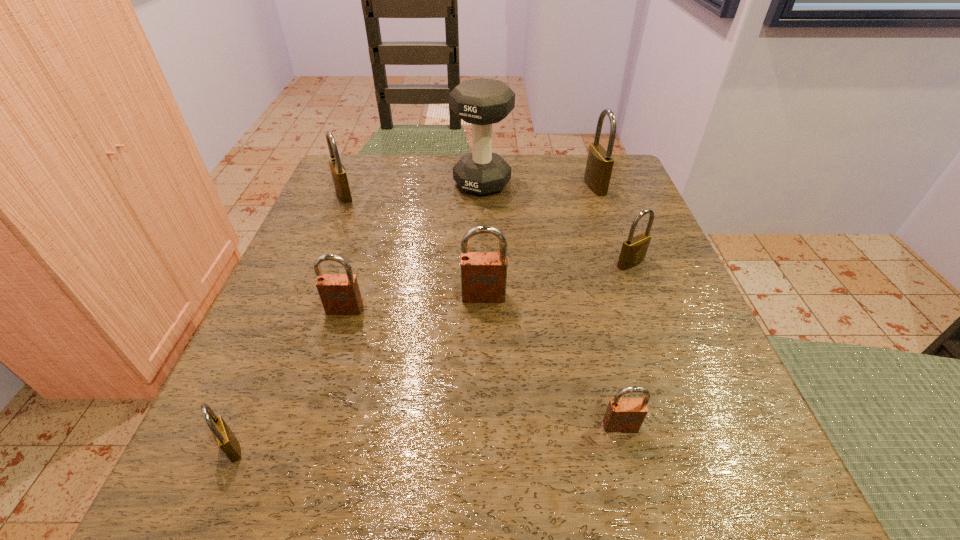
The height and width of the screenshot is (540, 960). In the image, there is a desktop. Identify the location of vacant space at the right edge. (694, 414).

In the image, there is a desktop. At what (x,y) coordinates should I click in order to perform the action: click on blank space at the far left corner. Please return your answer as a coordinate pair (x, y). Looking at the image, I should click on (376, 204).

Where is `vacant space at the near left corner of the desktop`? vacant space at the near left corner of the desktop is located at coordinates (287, 461).

Identify the location of vacant region at the far right corner of the desktop. The width and height of the screenshot is (960, 540). (626, 171).

What are the coordinates of `vacant region between the tallest object and the seventh shortest object` in the screenshot? It's located at (539, 185).

Where is `free space between the sixth farthest object and the seventh shortest object`? free space between the sixth farthest object and the seventh shortest object is located at coordinates (469, 248).

You are a GUI agent. You are given a task and a screenshot of the screen. Output one action in this format:
    pyautogui.click(x=<x>, y=<y>)
    Task: Click on the free spot between the smallest brass padlock and the third object from right to left
    
    Given the screenshot: What is the action you would take?
    pyautogui.click(x=426, y=437)

At what (x,y) coordinates should I click in order to perform the action: click on vacant space that is in between the smallest brass padlock and the sixth object from left to right. Please return your answer as a coordinate pair (x, y). Looking at the image, I should click on (426, 437).

Find the location of a particular element. This screenshot has width=960, height=540. vacant point located between the gray dumbbell and the fifth padlock from left to right is located at coordinates (551, 305).

I want to click on vacant area that lies between the farthest brown padlock and the smallest brass padlock, so click(x=358, y=372).